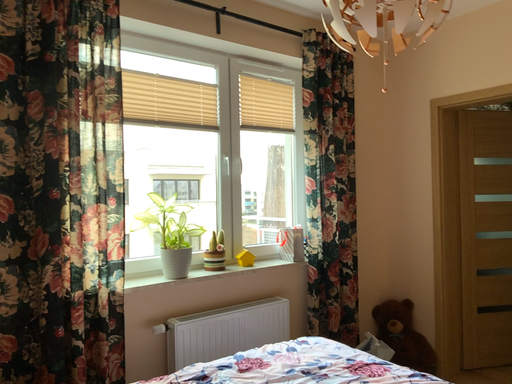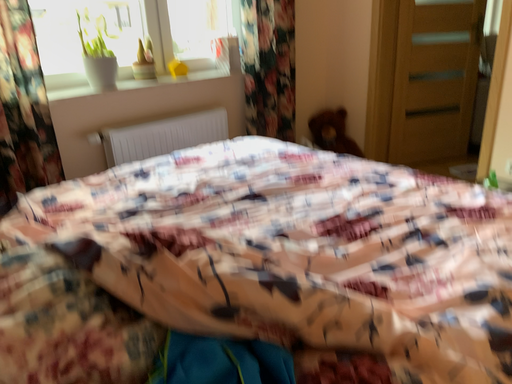
Question: Which way did the camera rotate in the video?

Choices:
 (A) rotated left
 (B) rotated right

Answer: (B)